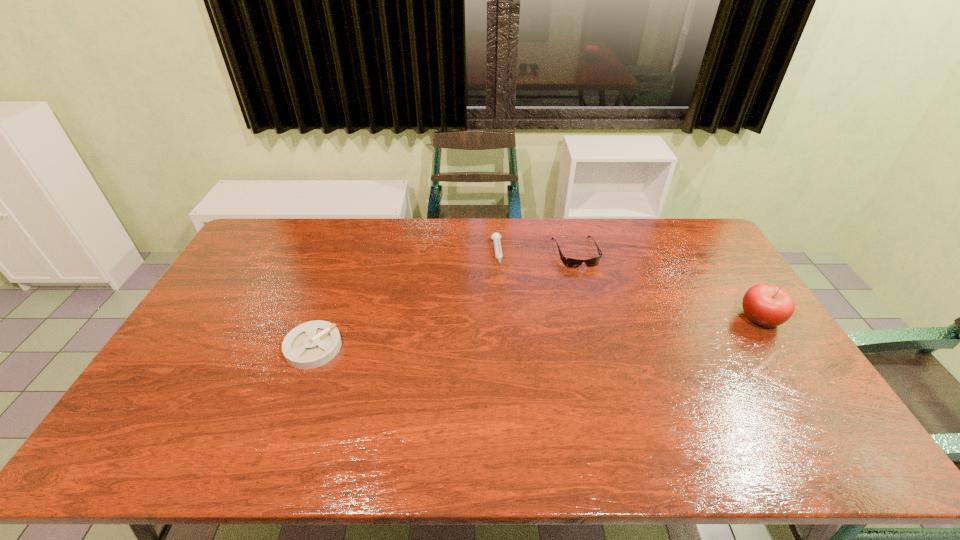
Find the location of a particular element. This screenshot has height=540, width=960. vacant space that's between the tallest object and the third object from right to left is located at coordinates (629, 286).

You are a GUI agent. You are given a task and a screenshot of the screen. Output one action in this format:
    pyautogui.click(x=<x>, y=<y>)
    Task: Click on the closest object to the third object from right to left
    This screenshot has width=960, height=540.
    Given the screenshot: What is the action you would take?
    pyautogui.click(x=568, y=262)

Point out which object is positioned as the third nearest to the rightmost object. Please provide its 2D coordinates. Your answer should be formatted as a tuple, i.e. [(x, y)], where the tuple contains the x and y coordinates of a point satisfying the conditions above.

[(312, 344)]

Locate an element on the screen. vacant region that satisfies the following two spatial constraints: 1. on the back side of the third object from left to right; 2. on the right side of the syringe is located at coordinates (496, 252).